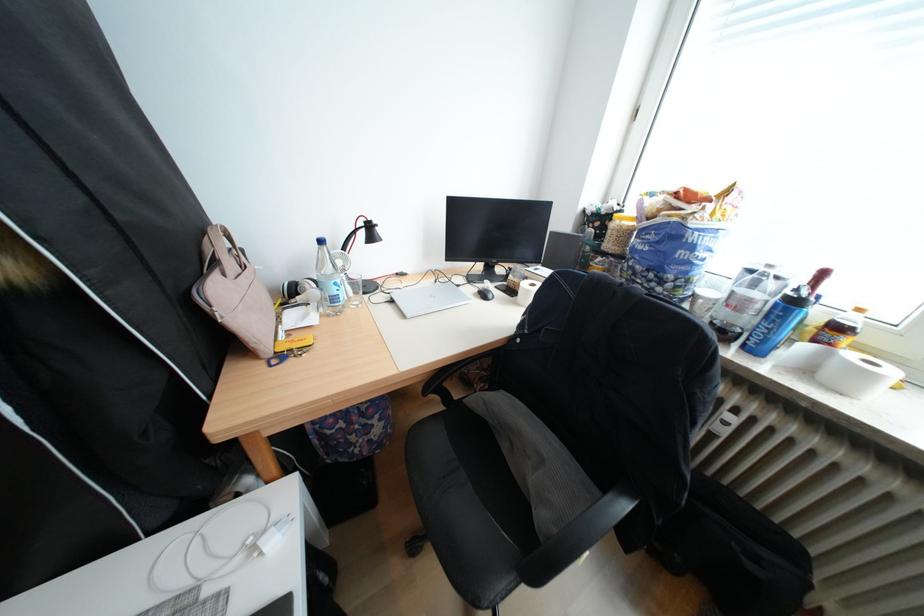
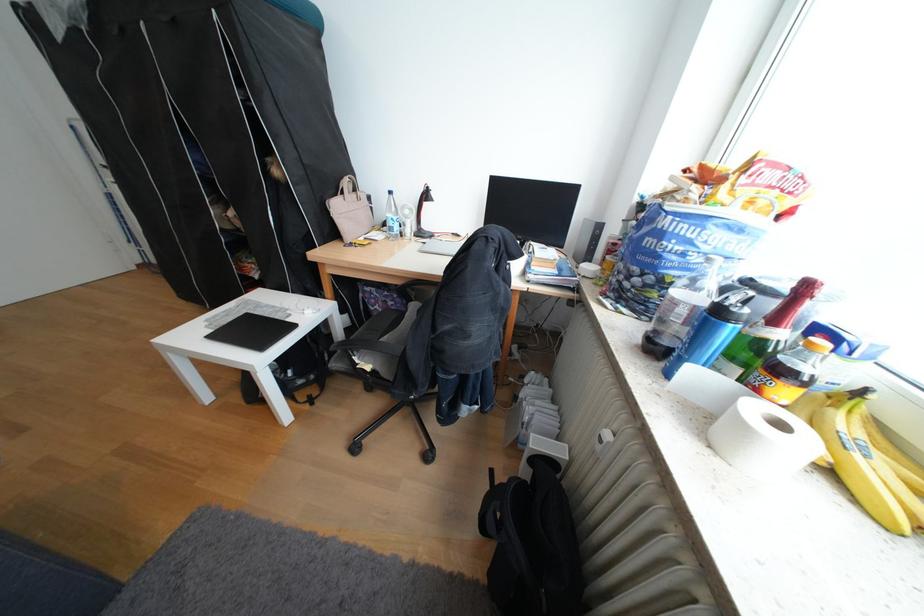
In the second image, find the point that corresponds to (772,307) in the first image.

(695, 312)